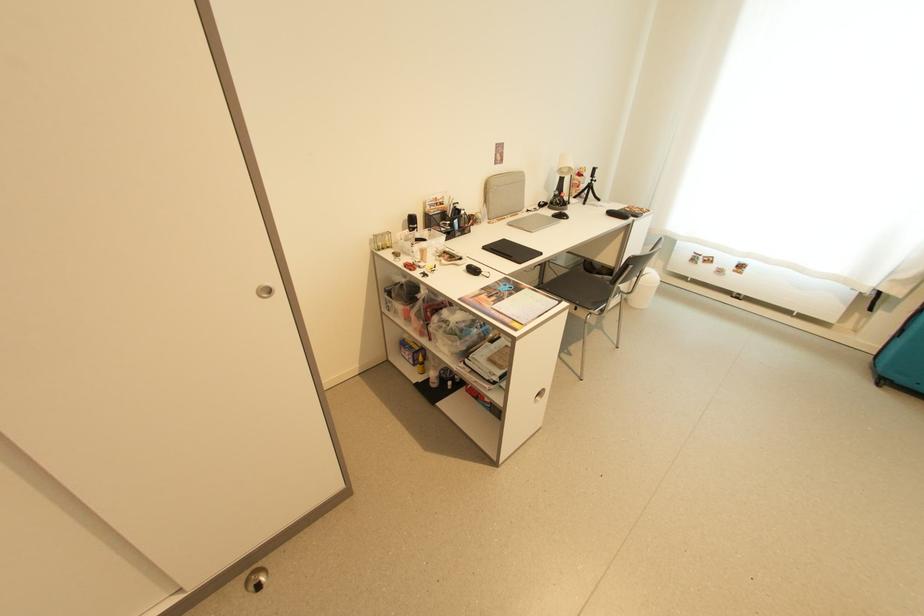
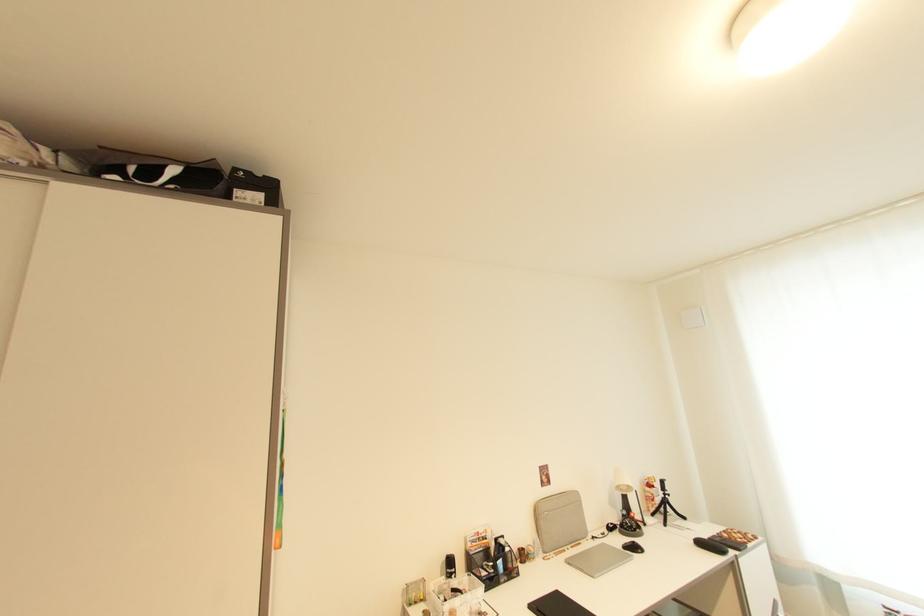
Locate, in the second image, the point that corresponds to point 566,217 in the first image.

(639, 549)